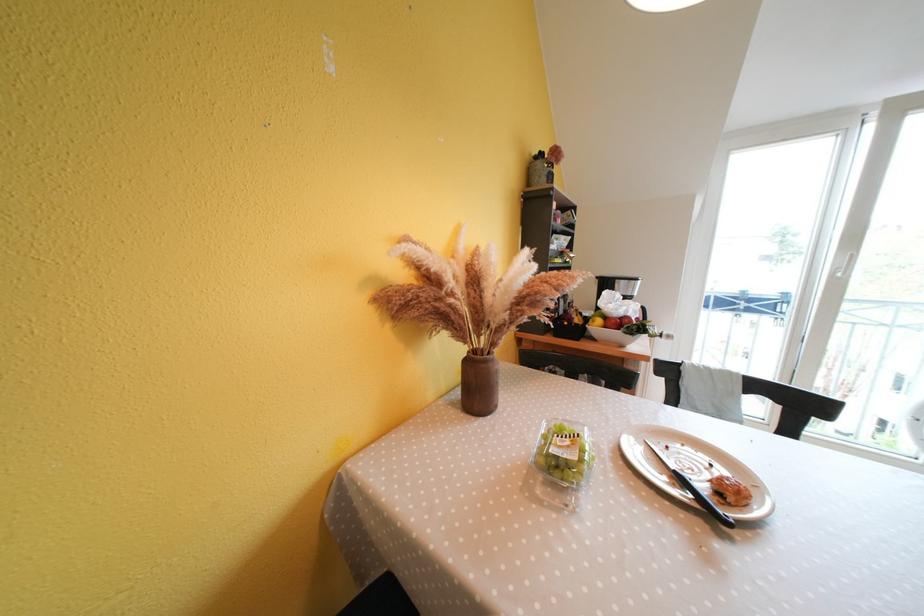
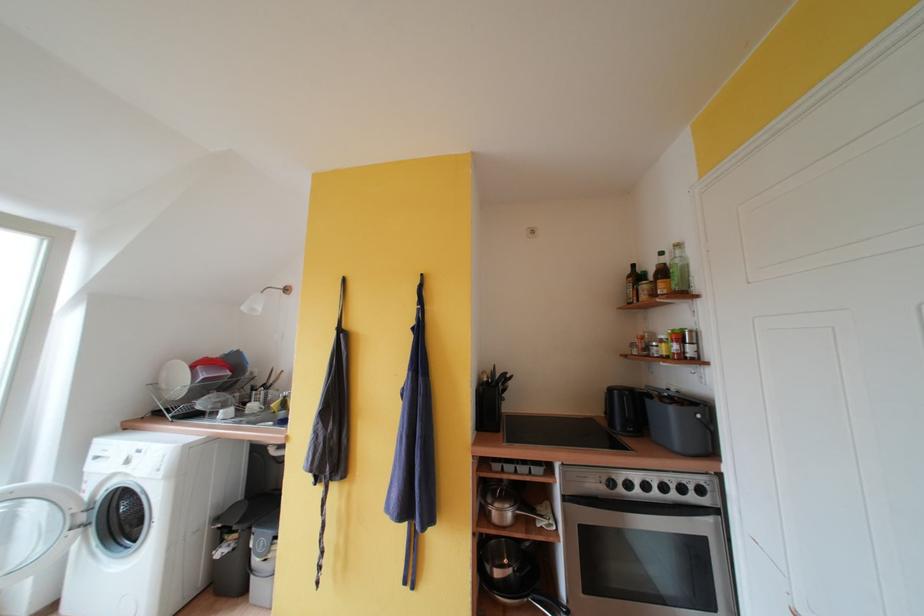
Question: The camera is either moving clockwise (left) or counter-clockwise (right) around the object. The first image is from the beginning of the video and the second image is from the end. Is the camera moving left or right when shooting the video?

Choices:
 (A) Left
 (B) Right

Answer: (A)